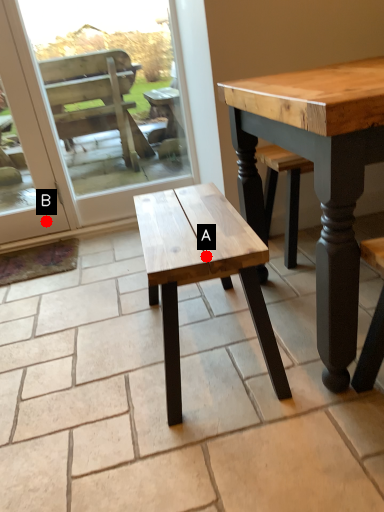
Question: Two points are circled on the image, labeled by A and B beside each circle. Which point is closer to the camera?

Choices:
 (A) A is closer
 (B) B is closer

Answer: (A)